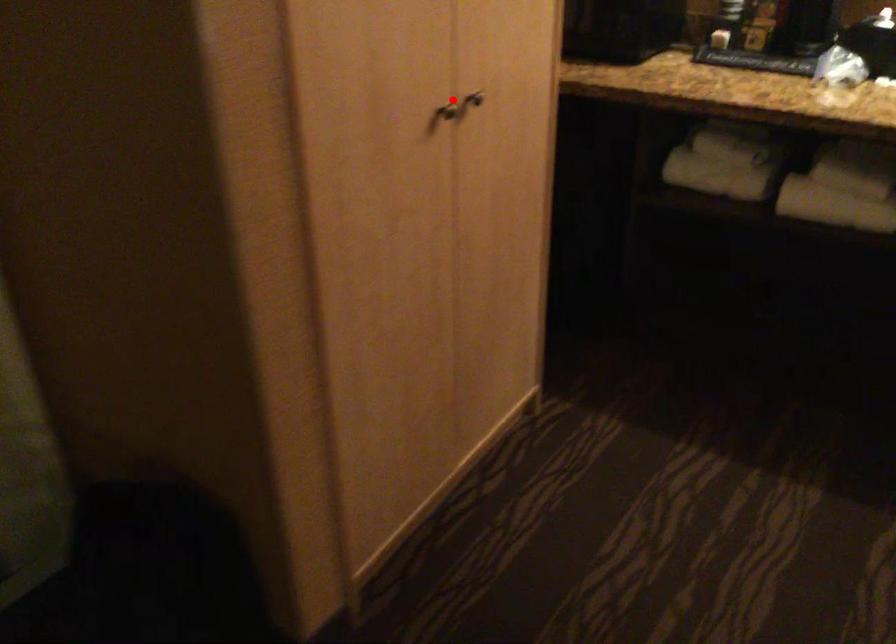
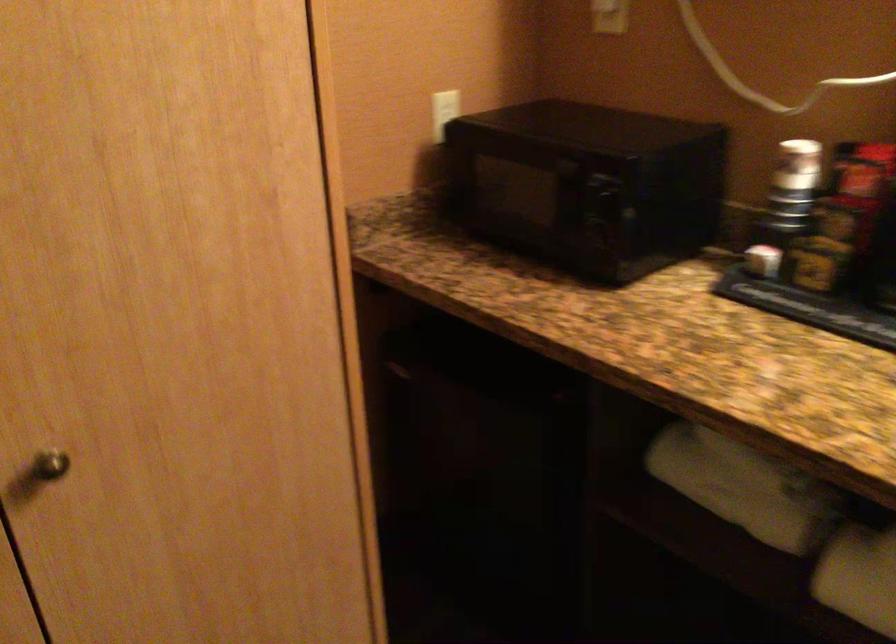
The point at the highlighted location is marked in the first image. Where is the corresponding point in the second image?

(49, 465)